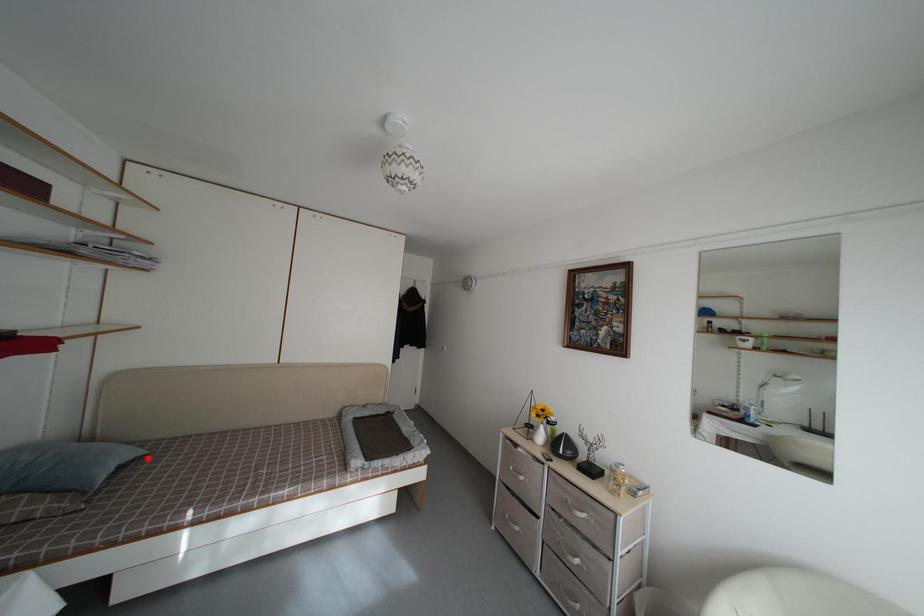
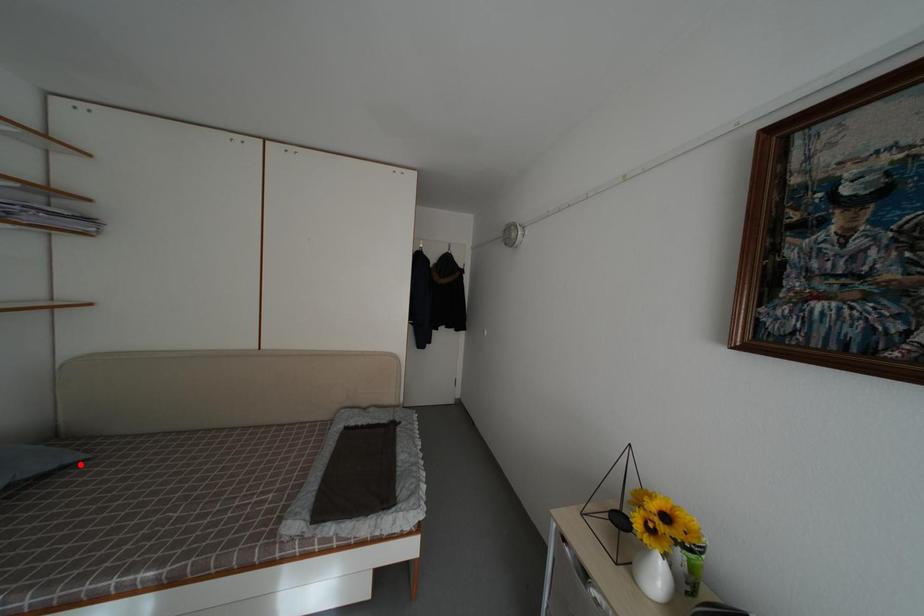
I am providing you with two images of the same scene from different viewpoints. A red point is marked on the first image and another point is marked on the second image. Is the marked point in image1 the same physical position as the marked point in image2?

Yes